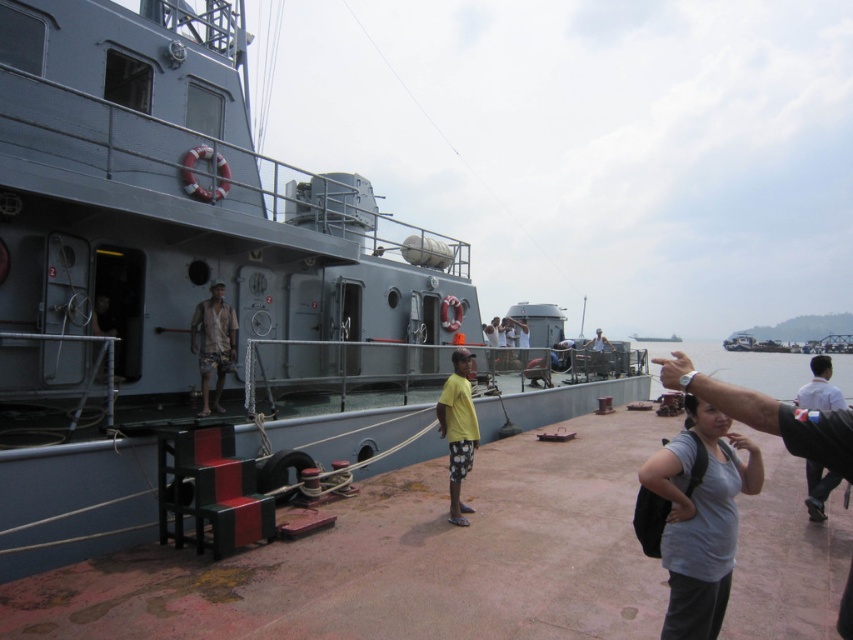
Question: Can you confirm if camouflage shorts at center is positioned to the left of metallic gray boat at center?

Choices:
 (A) no
 (B) yes

Answer: (B)

Question: Is yellow matte shirt at center closer to the viewer compared to metallic gray boat at center?

Choices:
 (A) yes
 (B) no

Answer: (A)

Question: Which object is farther from the camera taking this photo?

Choices:
 (A) camouflage shorts at center
 (B) white shirt at right
 (C) gray matte boat at center
 (D) yellow matte shirt at center

Answer: (A)

Question: Is camouflage shorts at center closer to camera compared to metallic helmet at center?

Choices:
 (A) no
 (B) yes

Answer: (B)

Question: Among these objects, which one is nearest to the camera?

Choices:
 (A) camouflage shorts at center
 (B) metallic helmet at center
 (C) gray matte shirt at lower right

Answer: (C)

Question: Which of these objects is positioned farthest from the gray matte shirt at lower right?

Choices:
 (A) camouflage shorts at center
 (B) gray matte boat at center

Answer: (B)